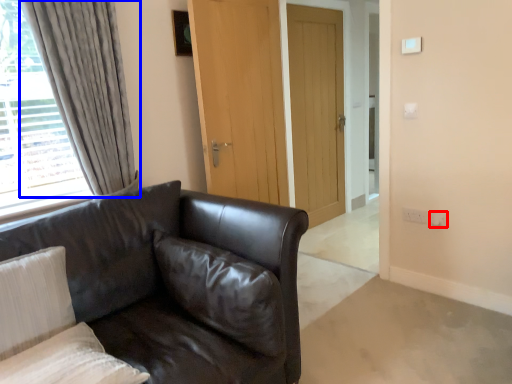
Question: Which object is closer to the camera taking this photo, electric outlet (highlighted by a red box) or curtain (highlighted by a blue box)?

Choices:
 (A) electric outlet
 (B) curtain

Answer: (B)